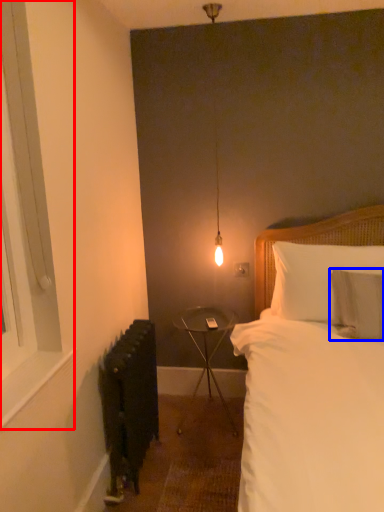
Question: Which of the following is the closest to the observer, window (highlighted by a red box) or pillow (highlighted by a blue box)?

Choices:
 (A) window
 (B) pillow

Answer: (A)